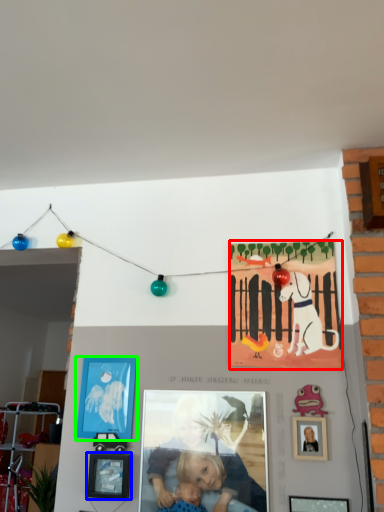
Question: Which object is positioned farthest from poster (highlighted by a red box)? Select from picture frame (highlighted by a blue box) and picture frame (highlighted by a green box).

Choices:
 (A) picture frame
 (B) picture frame

Answer: (A)